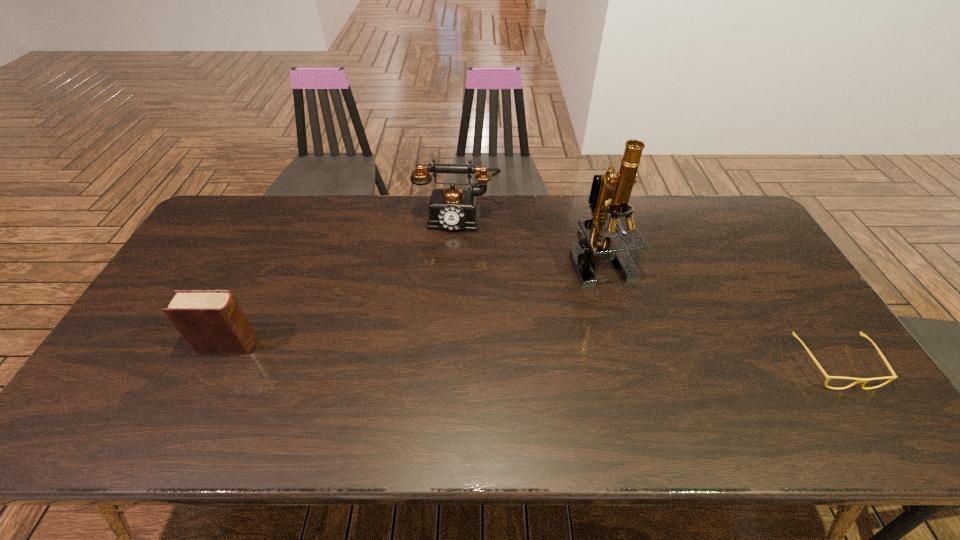
This screenshot has height=540, width=960. Find the location of `free area in between the spectacles and the microscope`. free area in between the spectacles and the microscope is located at coordinates (717, 311).

Identify the location of blank region between the third shortest object and the third object from left to right. (529, 237).

Find the location of a particular element. The image size is (960, 540). vacant area that lies between the shortest object and the third object from right to left is located at coordinates (646, 291).

Where is `empty location between the second tallest object and the second shortest object`? This screenshot has width=960, height=540. empty location between the second tallest object and the second shortest object is located at coordinates (344, 281).

At what (x,y) coordinates should I click in order to perform the action: click on unoccupied area between the diary and the second object from right to left. Please return your answer as a coordinate pair (x, y). The width and height of the screenshot is (960, 540). Looking at the image, I should click on (415, 301).

This screenshot has height=540, width=960. I want to click on vacant area between the spectacles and the tallest object, so click(717, 311).

Locate which object ranks second in proximity to the tallest object. Please provide its 2D coordinates. Your answer should be formatted as a tuple, i.e. [(x, y)], where the tuple contains the x and y coordinates of a point satisfying the conditions above.

[(864, 380)]

Select which object appears as the second closest to the third shortest object. Please provide its 2D coordinates. Your answer should be formatted as a tuple, i.e. [(x, y)], where the tuple contains the x and y coordinates of a point satisfying the conditions above.

[(211, 321)]